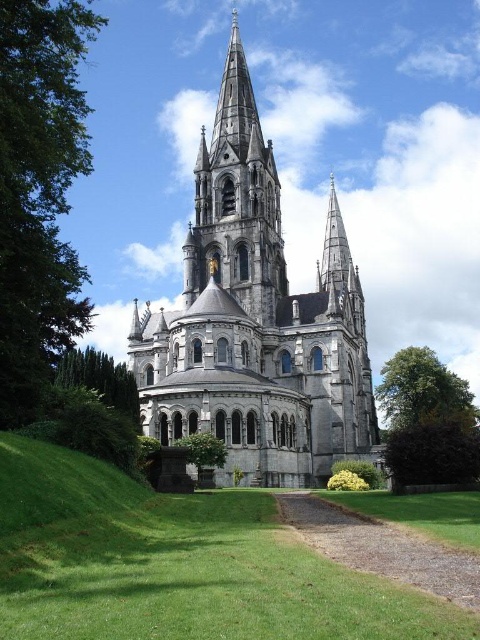
You are a visitor standing at the entrance of the cathedral. Looking towards the green leafy tree at upper left and the green leafy tree at lower center, which tree appears closer to you?

The green leafy tree at lower center appears closer because it is positioned below the green leafy tree at upper left, which is placed further away in the background.

You are a landscape architect designing a walking path between the green leafy tree at upper left and the green leafy tree at lower left. Given that the path must be straight and the trees are 18.26 meters apart, what is the minimum length of the path required to connect them?

The minimum length of the path required to connect the green leafy tree at upper left and the green leafy tree at lower left is 18.26 meters, as the straight line distance between them is exactly that.

You are standing in the cathedral grounds and notice two green leafy trees. One is the green leafy tree at upper left and the other is the green leafy tree at lower center. From your vantage point, which tree is positioned to the left of the other?

The green leafy tree at upper left is positioned to the left of the green leafy tree at lower center.